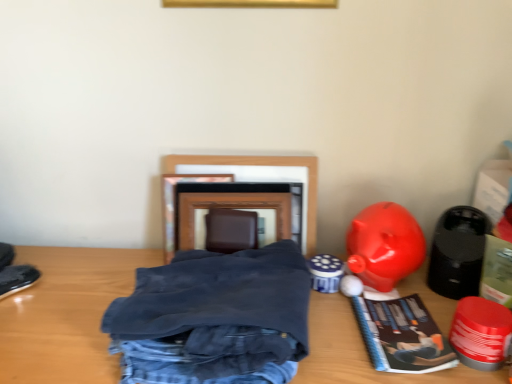
You are a GUI agent. You are given a task and a screenshot of the screen. Output one action in this format:
    pyautogui.click(x=<x>, y=<y>)
    Task: Click on the free location to the left of black matte speaker at right, acting as the third toy starting from the left
    The width and height of the screenshot is (512, 384).
    Given the screenshot: What is the action you would take?
    pyautogui.click(x=372, y=303)